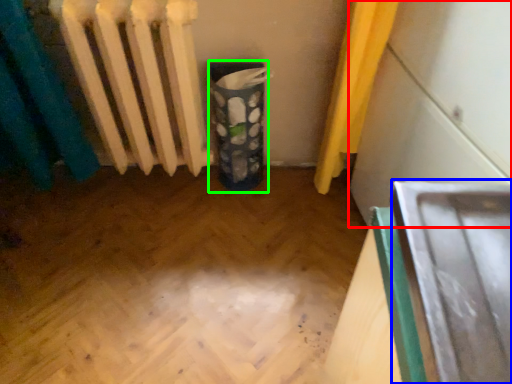
Question: Which object is the closest to the wide (highlighted by a red box)? Choose among these: wide (highlighted by a blue box) or recycling bin (highlighted by a green box).

Choices:
 (A) wide
 (B) recycling bin

Answer: (B)